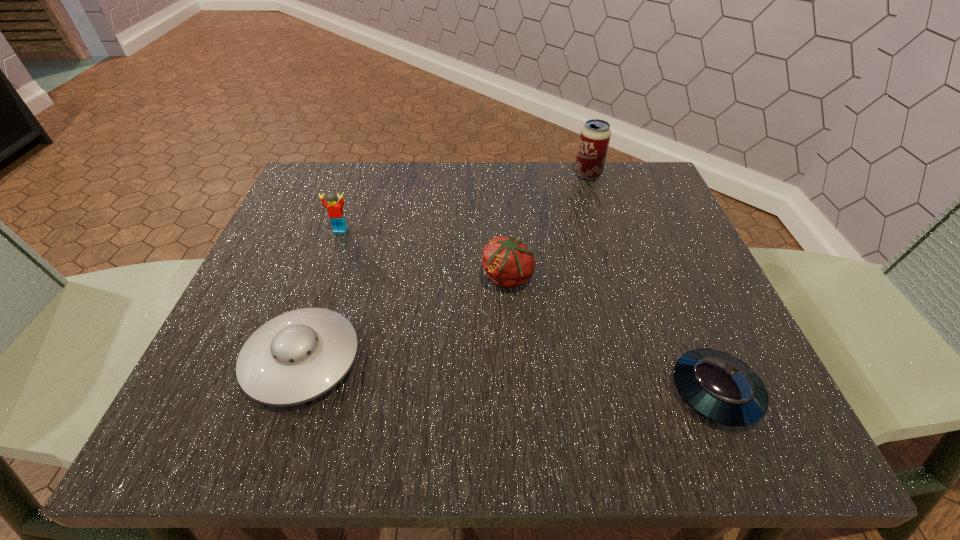
You are a GUI agent. You are given a task and a screenshot of the screen. Output one action in this format:
    pyautogui.click(x=<x>, y=<y>)
    Task: Click on the unoccupied area between the farthest object and the Lego
    
    Given the screenshot: What is the action you would take?
    pyautogui.click(x=465, y=202)

Find the location of a particular element. This screenshot has width=960, height=540. free area in between the beer can and the second farthest object is located at coordinates (465, 202).

Where is `vacant point located between the shortest object and the tomato`? The width and height of the screenshot is (960, 540). vacant point located between the shortest object and the tomato is located at coordinates (612, 335).

Find the location of a particular element. This screenshot has width=960, height=540. free space between the right saucer and the taller saucer is located at coordinates (509, 376).

Where is `unoccupied area between the tallest object and the right saucer`? unoccupied area between the tallest object and the right saucer is located at coordinates (652, 283).

The height and width of the screenshot is (540, 960). I want to click on unoccupied area between the left saucer and the third object from right to left, so click(x=405, y=319).

This screenshot has height=540, width=960. What are the coordinates of `unoccupied position between the tomato and the beer can` in the screenshot? It's located at (548, 226).

Image resolution: width=960 pixels, height=540 pixels. Identify the location of empty space that is in between the right saucer and the third object from left to right. (612, 335).

I want to click on vacant area that lies between the tomato and the shorter saucer, so click(x=612, y=335).

Where is `the fourth closest object to the Lego`? The width and height of the screenshot is (960, 540). the fourth closest object to the Lego is located at coordinates (722, 388).